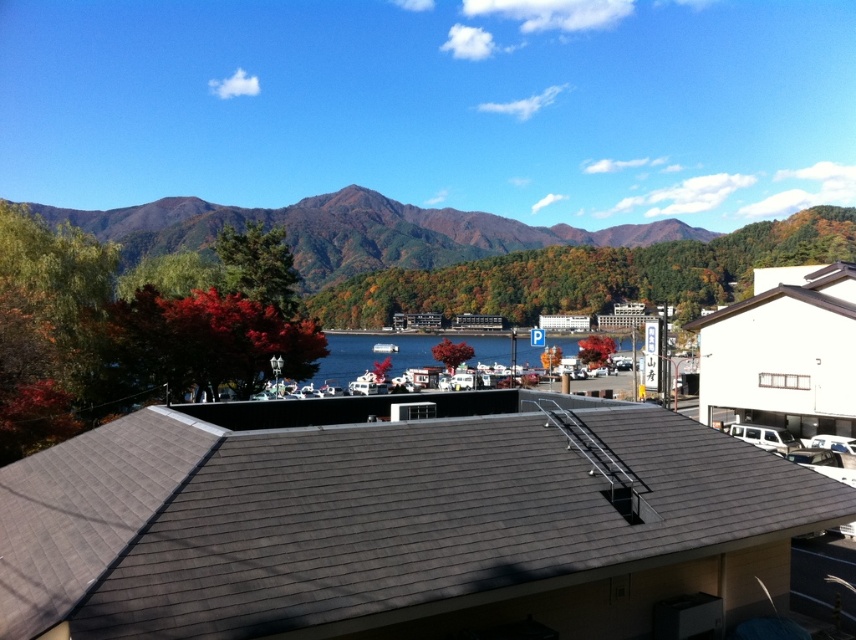
Question: Which object is closer to the camera taking this photo?

Choices:
 (A) white matte van at center-right
 (B) blue water at center
 (C) white plastic boat at center

Answer: (A)

Question: Does green forested mountain at upper center have a larger size compared to blue water at center?

Choices:
 (A) no
 (B) yes

Answer: (B)

Question: Among these points, which one is nearest to the camera?

Choices:
 (A) (385, 337)
 (B) (387, 353)
 (C) (363, 276)
 (D) (753, 444)

Answer: (D)

Question: Does green forested mountain at upper center come behind white matte van at center-right?

Choices:
 (A) yes
 (B) no

Answer: (A)

Question: Which object is closer to the camera taking this photo?

Choices:
 (A) white plastic boat at center
 (B) green forested mountain at upper center
 (C) white matte van at center-right

Answer: (C)

Question: Can you confirm if white matte van at center-right is thinner than white plastic boat at center?

Choices:
 (A) no
 (B) yes

Answer: (B)